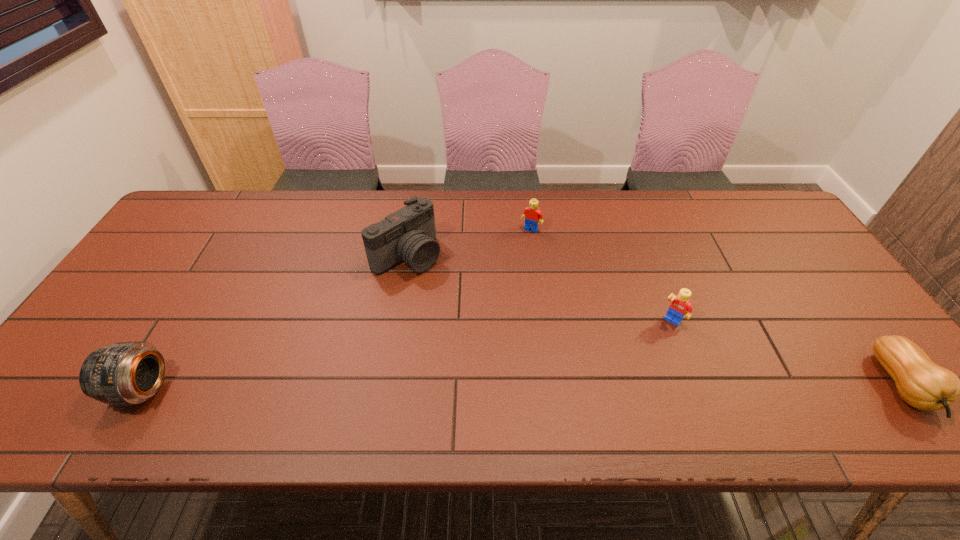
The height and width of the screenshot is (540, 960). I want to click on telephoto lens, so click(x=125, y=373).

Locate an element on the screen. The height and width of the screenshot is (540, 960). the rightmost object is located at coordinates (921, 383).

Identify the location of the nearer Lego. (680, 304).

Identify the location of the third farthest object. (680, 304).

This screenshot has height=540, width=960. I want to click on the second object from left to right, so pos(408,235).

You are a GUI agent. You are given a task and a screenshot of the screen. Output one action in this format:
    pyautogui.click(x=<x>, y=<y>)
    Task: Click on the camera
    The height and width of the screenshot is (540, 960).
    Given the screenshot: What is the action you would take?
    pyautogui.click(x=408, y=235)

Identify the location of the third object from right to left. This screenshot has width=960, height=540. (532, 214).

The image size is (960, 540). I want to click on the farthest object, so click(532, 214).

At what (x,y) coordinates should I click in order to perform the action: click on free space located 0.120m at the front element of the telephoto lens. Please return your answer as a coordinate pair (x, y). This screenshot has width=960, height=540. Looking at the image, I should click on (64, 389).

Locate an element on the screen. The width and height of the screenshot is (960, 540). free space located at the front element of the telephoto lens is located at coordinates (47, 389).